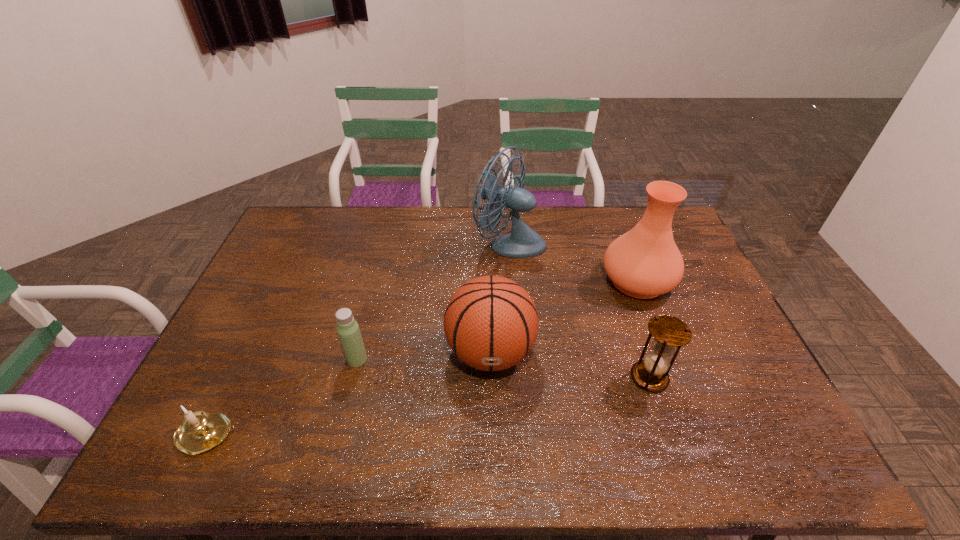
Locate an element on the screen. The height and width of the screenshot is (540, 960). fan is located at coordinates (523, 242).

You are a GUI agent. You are given a task and a screenshot of the screen. Output one action in this format:
    pyautogui.click(x=<x>, y=<y>)
    Task: Click on the vase
    
    Given the screenshot: What is the action you would take?
    pyautogui.click(x=643, y=263)

Where is `the fourth shortest object`? The image size is (960, 540). the fourth shortest object is located at coordinates (491, 323).

Locate an element on the screen. hourglass is located at coordinates (669, 333).

This screenshot has height=540, width=960. Find the location of `thermos bottle`. thermos bottle is located at coordinates (348, 330).

Where is `the shortest object`? the shortest object is located at coordinates (199, 432).

Identify the location of the nearest object. The height and width of the screenshot is (540, 960). (199, 432).

Find the location of a particular element. The height and width of the screenshot is (540, 960). blank space located in front of the fan to blow air is located at coordinates (400, 243).

Where is `blank space located 0.280m in front of the fan to blow air`? The height and width of the screenshot is (540, 960). blank space located 0.280m in front of the fan to blow air is located at coordinates (395, 243).

Locate an element on the screen. Image resolution: width=960 pixels, height=540 pixels. free location located in front of the fan to blow air is located at coordinates (400, 243).